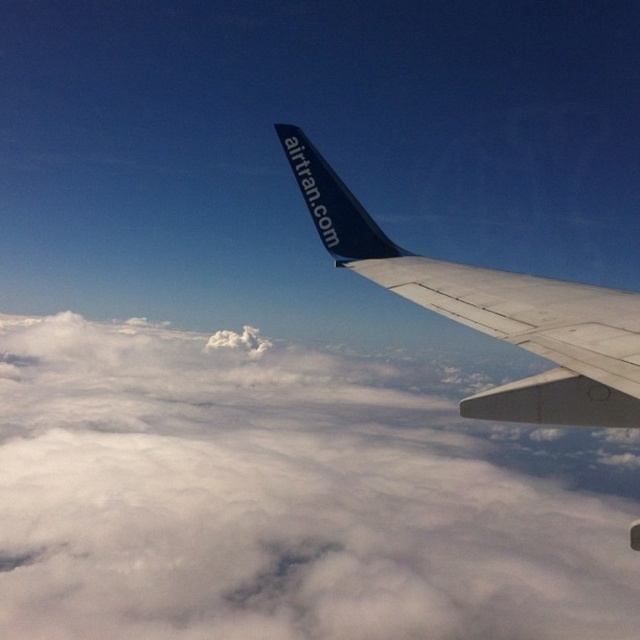
Question: Which object appears farthest from the camera in this image?

Choices:
 (A) white fluffy cloud at upper center
 (B) matte blue wing at upper right

Answer: (B)

Question: Does white fluffy cloud at upper center lie in front of matte blue wing at upper right?

Choices:
 (A) yes
 (B) no

Answer: (A)

Question: Does white fluffy cloud at upper center have a greater width compared to matte blue wing at upper right?

Choices:
 (A) yes
 (B) no

Answer: (A)

Question: Does white fluffy cloud at upper center appear over matte blue wing at upper right?

Choices:
 (A) yes
 (B) no

Answer: (B)